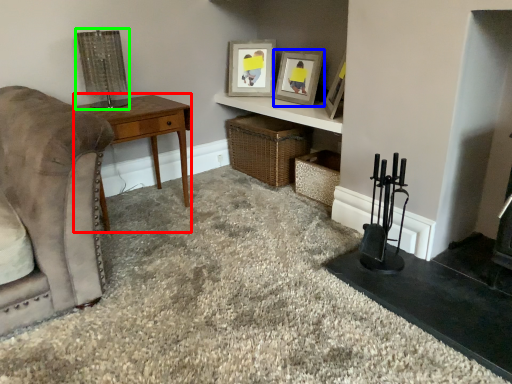
Question: Considering the real-world distances, which object is farthest from desk (highlighted by a red box)? picture frame (highlighted by a blue box) or lamp (highlighted by a green box)?

Choices:
 (A) picture frame
 (B) lamp

Answer: (A)